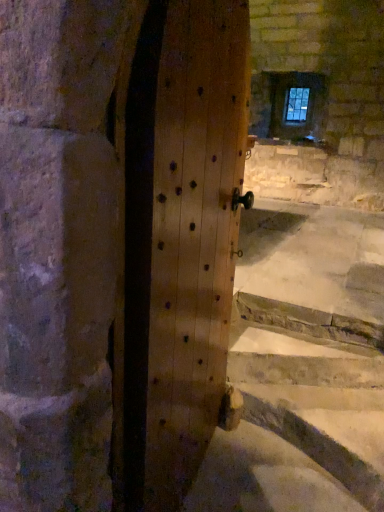
What do you see at coordinates (296, 106) in the screenshot?
I see `clear glass window at upper center` at bounding box center [296, 106].

Find the location of a particular element. This screenshot has width=384, height=512. clear glass window at upper center is located at coordinates (296, 106).

I want to click on natural wood door at center, so coord(177,244).

What do you see at coordinates (177, 244) in the screenshot? This screenshot has height=512, width=384. I see `natural wood door at center` at bounding box center [177, 244].

This screenshot has width=384, height=512. Find the location of `clear glass window at upper center`. clear glass window at upper center is located at coordinates (296, 106).

Between natural wood door at center and clear glass window at upper center, which one appears on the right side from the viewer's perspective?

Positioned to the right is clear glass window at upper center.

Based on the photo, is the position of natural wood door at center more distant than that of clear glass window at upper center?

No, the depth of natural wood door at center is less than that of clear glass window at upper center.

Which is nearer, (210, 438) or (300, 106)?

Point (210, 438) appears to be closer to the viewer than point (300, 106).

From the image's perspective, is natural wood door at center located beneath clear glass window at upper center?

Correct, natural wood door at center appears lower than clear glass window at upper center in the image.

From a real-world perspective, who is located lower, natural wood door at center or clear glass window at upper center?

natural wood door at center, from a real-world perspective.

Which object is thinner, natural wood door at center or clear glass window at upper center?

Thinner between the two is clear glass window at upper center.

Does natural wood door at center have a lesser height compared to clear glass window at upper center?

In fact, natural wood door at center may be taller than clear glass window at upper center.

Between natural wood door at center and clear glass window at upper center, which one has larger size?

Bigger between the two is natural wood door at center.

Can we say natural wood door at center lies outside clear glass window at upper center?

Indeed, natural wood door at center is completely outside clear glass window at upper center.

Is natural wood door at center far away from clear glass window at upper center?

Absolutely, natural wood door at center is distant from clear glass window at upper center.

Is natural wood door at center positioned with its back to clear glass window at upper center?

No.

I want to click on window positioned vertically above the natural wood door at center (from a real-world perspective), so click(x=296, y=106).

Is clear glass window at upper center at the left side of natural wood door at center?

In fact, clear glass window at upper center is to the right of natural wood door at center.

Considering the positions of objects clear glass window at upper center and natural wood door at center in the image provided, who is behind, clear glass window at upper center or natural wood door at center?

Positioned behind is clear glass window at upper center.

Considering the positions of points (308, 106) and (151, 123), is point (308, 106) closer to camera compared to point (151, 123)?

No, (308, 106) is behind (151, 123).

Consider the image. From the image's perspective, is clear glass window at upper center located beneath natural wood door at center?

Actually, clear glass window at upper center appears above natural wood door at center in the image.

From a real-world perspective, is clear glass window at upper center on natural wood door at center?

Yes, from a real-world perspective, clear glass window at upper center is above natural wood door at center.

Between clear glass window at upper center and natural wood door at center, which one has smaller width?

clear glass window at upper center.

Who is shorter, clear glass window at upper center or natural wood door at center?

clear glass window at upper center is shorter.

Does clear glass window at upper center have a larger size compared to natural wood door at center?

No, clear glass window at upper center is not bigger than natural wood door at center.

Would you say clear glass window at upper center is outside natural wood door at center?

clear glass window at upper center lies outside natural wood door at center's area.

Are clear glass window at upper center and natural wood door at center far apart?

Yes, clear glass window at upper center and natural wood door at center are located far from each other.

Consider the image. Is clear glass window at upper center oriented away from natural wood door at center?

That's not correct — clear glass window at upper center is not looking away from natural wood door at center.

How different are the orientations of clear glass window at upper center and natural wood door at center in degrees?

98 degrees.

Locate an element on the screen. window above the natural wood door at center (from the image's perspective) is located at coordinates (296, 106).

At what (x,y) coordinates should I click in order to perform the action: click on window behind the natural wood door at center. Please return your answer as a coordinate pair (x, y). This screenshot has height=512, width=384. Looking at the image, I should click on (296, 106).

Image resolution: width=384 pixels, height=512 pixels. I want to click on window positioned vertically above the natural wood door at center (from a real-world perspective), so click(x=296, y=106).